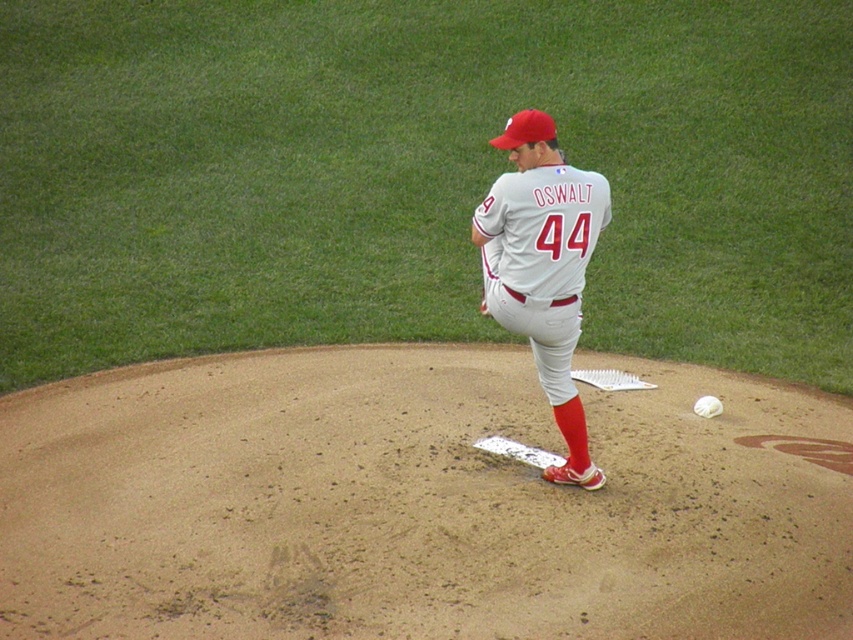
Question: Is brown dirt mound at center smaller than white matte baseball at center?

Choices:
 (A) yes
 (B) no

Answer: (B)

Question: Which point appears farthest from the camera in this image?

Choices:
 (A) (398, 612)
 (B) (540, 252)

Answer: (B)

Question: Estimate the real-world distances between objects in this image. Which object is farther from the white matte baseball at center?

Choices:
 (A) gray fabric baseball uniform at center
 (B) brown dirt mound at center

Answer: (B)

Question: Is brown dirt mound at center below white matte baseball at center?

Choices:
 (A) yes
 (B) no

Answer: (A)

Question: Does gray fabric baseball uniform at center appear under white matte baseball at center?

Choices:
 (A) no
 (B) yes

Answer: (A)

Question: Which of the following is the closest to the observer?

Choices:
 (A) brown dirt mound at center
 (B) white matte baseball at center

Answer: (A)